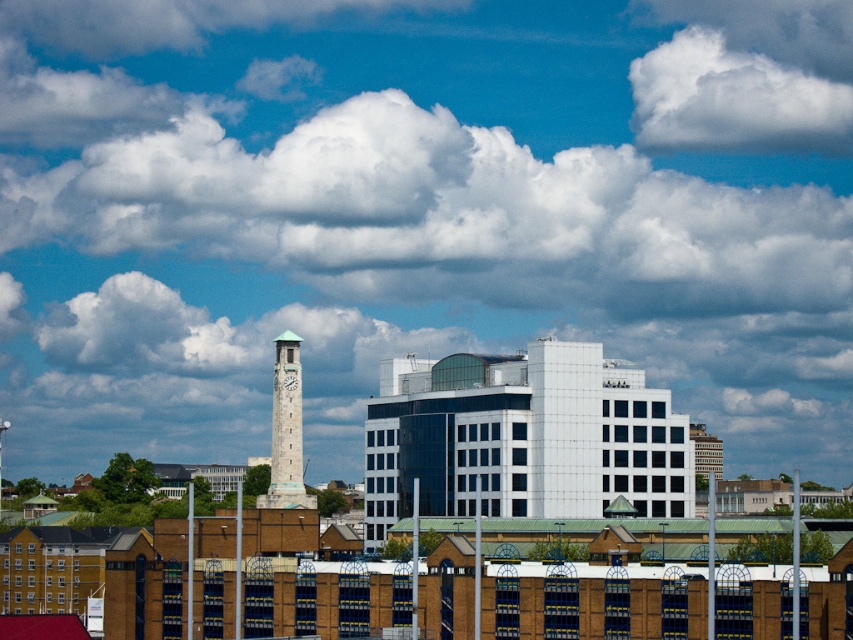
You are an architect analyzing the urban layout. You notice the green stone clock tower at left and the white fluffy cloud at upper center. Based on their positions, which object is closer to the observer?

The white fluffy cloud at upper center is closer to the observer because the green stone clock tower at left is behind it.

You are a drone operator trying to capture a photo of the white fluffy cloud at upper center. The drone is currently at point A located at coordinates (746, 88). Is the drone positioned correctly to take a clear photo of the cloud?

The white fluffy cloud at upper center is represented by point (746, 88), so the drone is positioned exactly at the cloud. However, being at the same point might mean the drone is too close to capture the entire cloud in the photo. Adjust the drone to a higher altitude or move slightly back to frame the cloud properly.